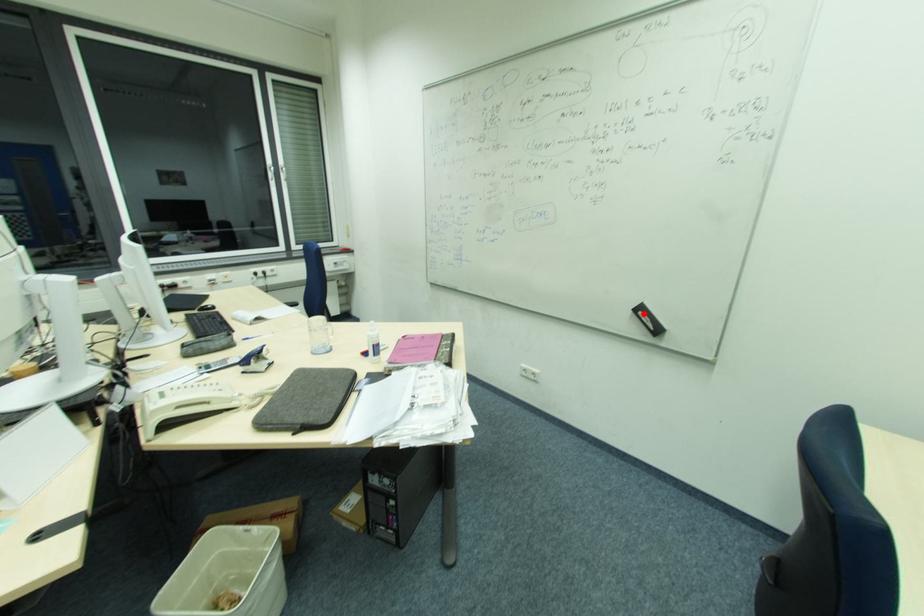
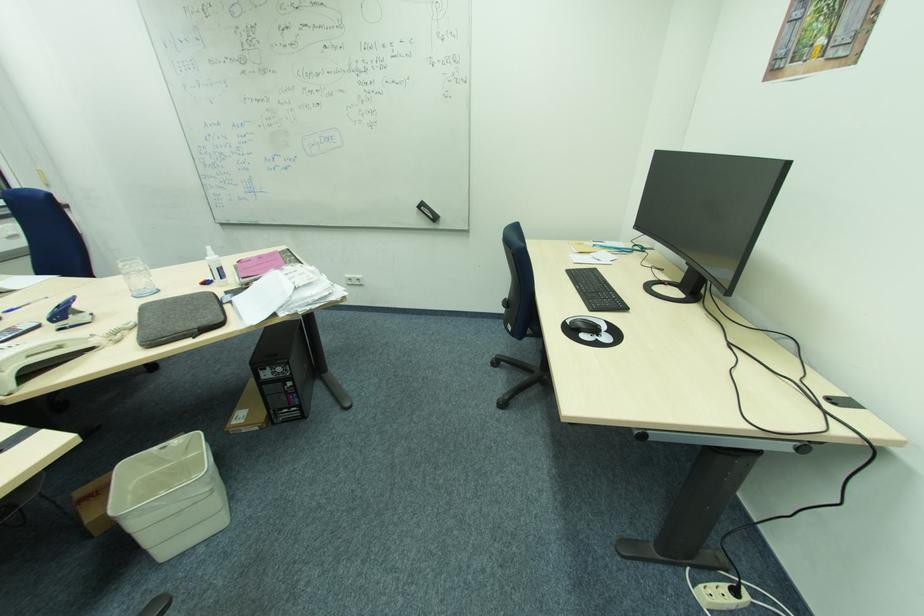
Question: I am providing you with two images of the same scene from different viewpoints. A red point is shown in image1. For the corresponding object point in image2, is it positioned nearer or farther from the camera?

Choices:
 (A) Nearer
 (B) Farther

Answer: (A)